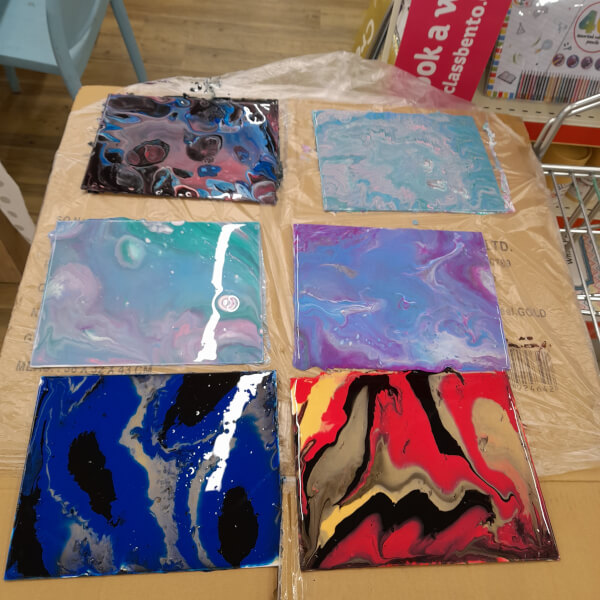
Where is `cardboard box`? The height and width of the screenshot is (600, 600). cardboard box is located at coordinates (563, 482).